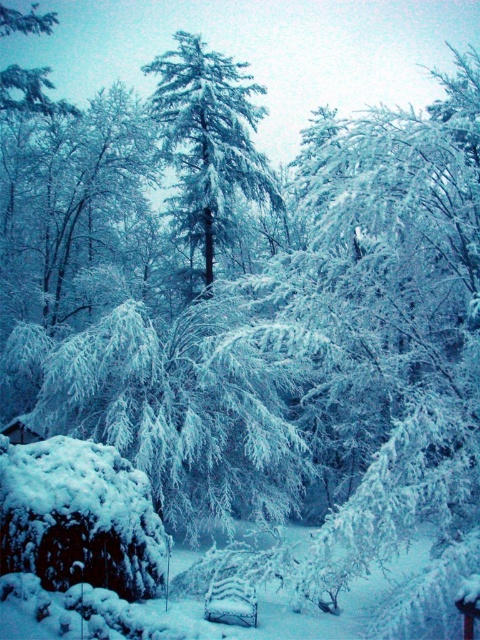
Which is behind, point (203, 140) or point (235, 624)?

Point (203, 140)

Does snow-covered pine tree at center have a greater width compared to white snow-covered bench at lower center?

Indeed, snow-covered pine tree at center has a greater width compared to white snow-covered bench at lower center.

The height and width of the screenshot is (640, 480). What are the coordinates of `snow-covered pine tree at center` in the screenshot? It's located at (208, 138).

Find the location of `snow-covered pine tree at center`. snow-covered pine tree at center is located at coordinates (208, 138).